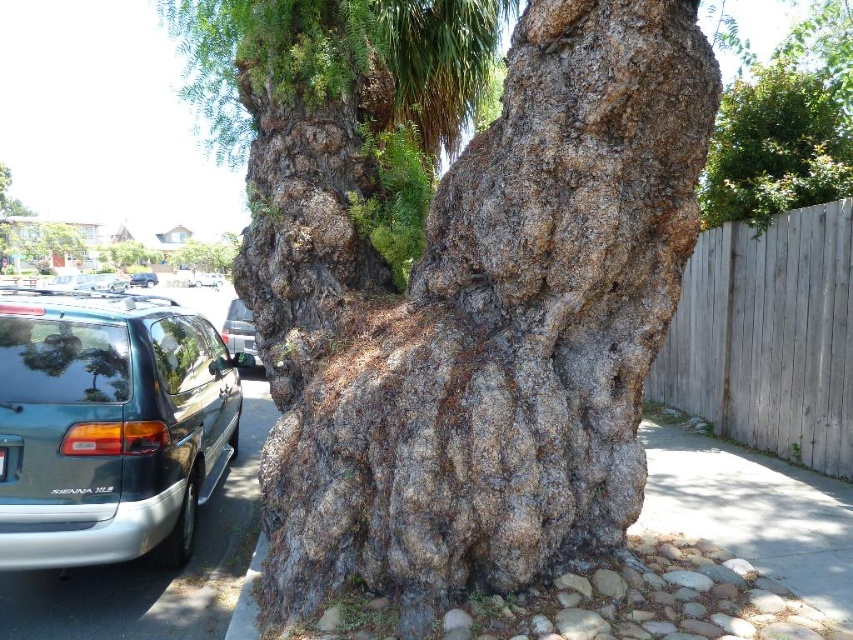
Question: Which object appears closest to the camera in this image?

Choices:
 (A) rough bark tree trunk at center
 (B) teal matte van at left
 (C) matte black van at center
 (D) gray concrete curb at lower center

Answer: (A)

Question: Among these objects, which one is farthest from the camera?

Choices:
 (A) teal matte van at left
 (B) green leafy tree at upper right
 (C) rough bark tree trunk at center
 (D) gray concrete curb at lower center

Answer: (B)

Question: Estimate the real-world distances between objects in this image. Which object is closer to the matte black van at center?

Choices:
 (A) metallic silver minivan at center
 (B) gray concrete curb at lower center

Answer: (A)

Question: Where is gray concrete curb at lower center located in relation to metallic silver minivan at center in the image?

Choices:
 (A) left
 (B) right

Answer: (B)

Question: Is rough bark tree trunk at center to the right of matte black van at center from the viewer's perspective?

Choices:
 (A) yes
 (B) no

Answer: (A)

Question: Is green leafy tree at upper right above gray concrete curb at lower center?

Choices:
 (A) no
 (B) yes

Answer: (B)